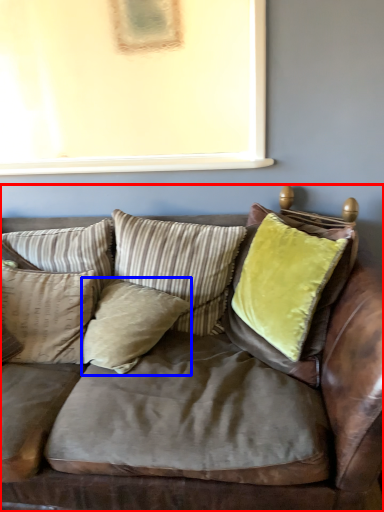
Question: Which of the following is the closest to the observer, studio couch (highlighted by a red box) or pillow (highlighted by a blue box)?

Choices:
 (A) studio couch
 (B) pillow

Answer: (A)